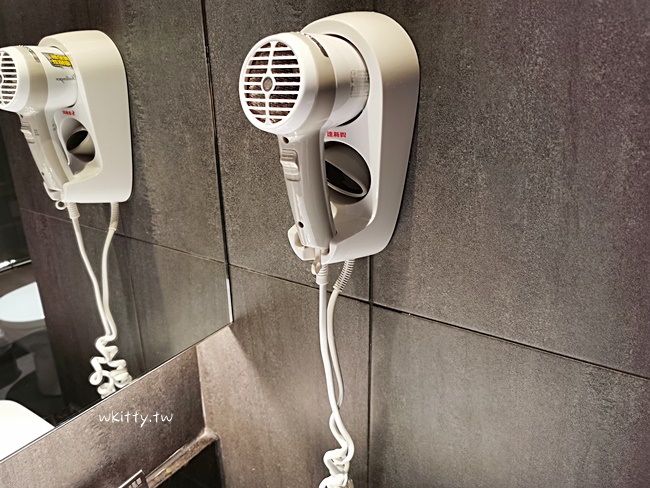
Identify the location of toilet. (21, 311).